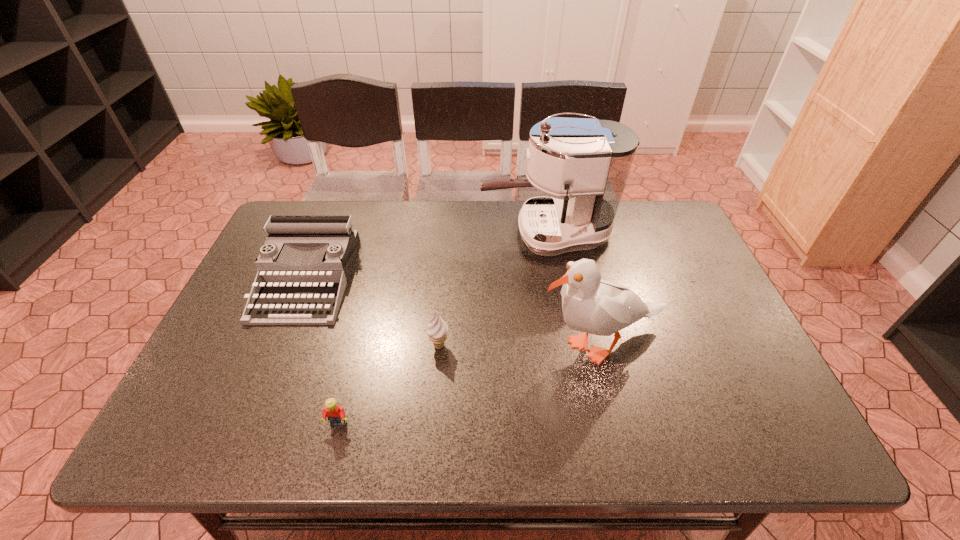
Locate an element on the screen. The width and height of the screenshot is (960, 540). coffee maker is located at coordinates (589, 160).

Find the location of a particular element. The width and height of the screenshot is (960, 540). the second tallest object is located at coordinates (589, 304).

Where is `icecream`? icecream is located at coordinates (437, 330).

This screenshot has height=540, width=960. What are the coordinates of `typewriter` in the screenshot? It's located at (295, 298).

At what (x,y) coordinates should I click in order to perform the action: click on the shortest object. Please return your answer as a coordinate pair (x, y). This screenshot has height=540, width=960. Looking at the image, I should click on (336, 415).

The image size is (960, 540). I want to click on Lego, so click(336, 415).

Identify the location of vacant space situated on the front-facing side of the coffee maker. The width and height of the screenshot is (960, 540). (429, 234).

At what (x,y) coordinates should I click in order to perform the action: click on vacant region located on the front-facing side of the coffee maker. Please return your answer as a coordinate pair (x, y). Looking at the image, I should click on (429, 234).

In order to click on vacant space situated 0.100m on the front-facing side of the coffee maker in this screenshot , I will do `click(448, 234)`.

At what (x,y) coordinates should I click in order to perform the action: click on vacant region located at the beak of the second tallest object. Please return your answer as a coordinate pair (x, y). The image size is (960, 540). Looking at the image, I should click on (455, 346).